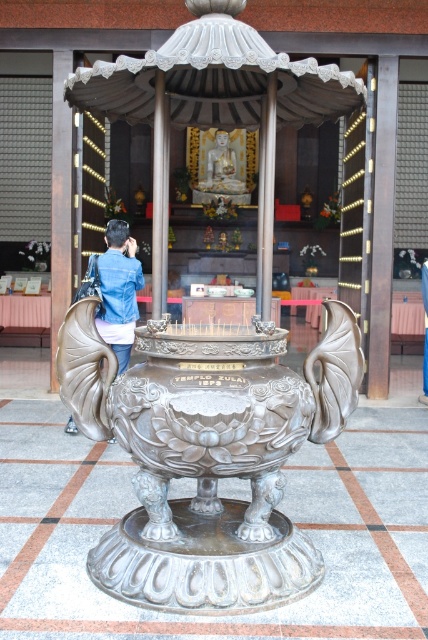
Is point (82, 340) positioned in front of point (124, 326)?

Yes, it is in front of point (124, 326).

Is point (157, 312) more distant than point (95, 257)?

No, it is in front of (95, 257).

Describe the element at coordinates (210, 348) in the screenshot. The image size is (428, 640). I see `polished silver sculpture at center` at that location.

At what (x,y) coordinates should I click in order to perform the action: click on polished silver sculpture at center. Please return your answer as a coordinate pair (x, y). Looking at the image, I should click on (210, 348).

Looking at this image, does denim jacket at left appear on the right side of white marble statue at center?

In fact, denim jacket at left is to the left of white marble statue at center.

Image resolution: width=428 pixels, height=640 pixels. I want to click on denim jacket at left, so click(x=116, y=289).

Is polished silver sculpture at center to the left of white marble statue at center from the viewer's perspective?

No, polished silver sculpture at center is not to the left of white marble statue at center.

Can you confirm if polished silver sculpture at center is positioned below white marble statue at center?

Indeed, polished silver sculpture at center is positioned under white marble statue at center.

The image size is (428, 640). Describe the element at coordinates (210, 348) in the screenshot. I see `polished silver sculpture at center` at that location.

This screenshot has width=428, height=640. In order to click on polished silver sculpture at center in this screenshot , I will do `click(210, 348)`.